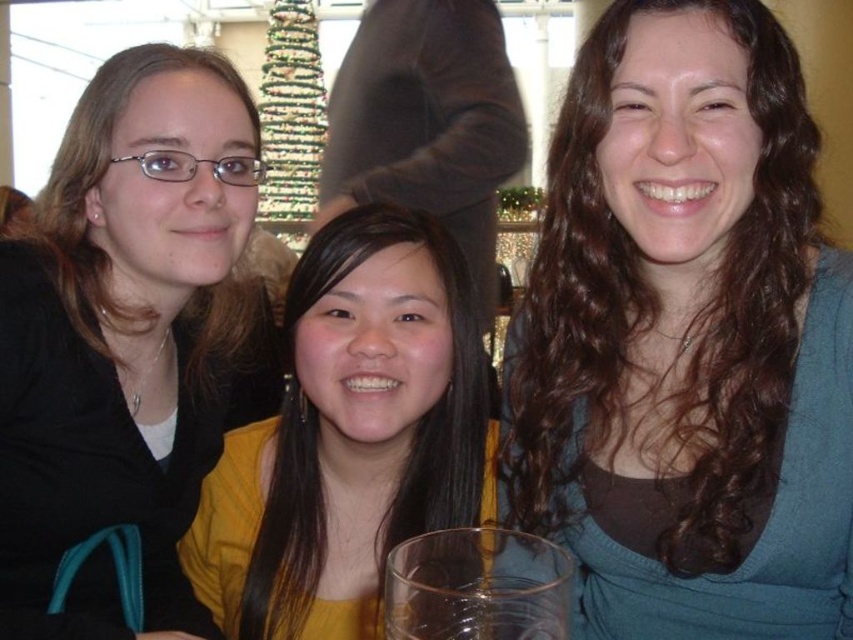
You are a photographer trying to capture a group photo of the matte black hair at left and the yellow matte shirt at center. Since you want to ensure both subjects are in focus, you need to know their relative positions. Which subject is positioned more to the left side?

The matte black hair at left is positioned on the left side of yellow matte shirt at center, so the matte black hair at left is more to the left.

Based on the photo, you are a photographer adjusting the camera settings for a group photo. You need to ensure that the brown curly hair at center and the yellow matte shirt at center are both clearly visible. Given that the camera can focus on objects up to 10 cm in width, which object should you prioritize focusing on to ensure clarity?

The brown curly hair at center has a smaller width than the yellow matte shirt at center, so you should prioritize focusing on the yellow matte shirt at center to ensure clarity since it is wider and may require more focus.

You are a photographer trying to capture a clear shot of the brown curly hair at center and the matte black hair at left. Based on their positions, which one is higher in the frame?

The brown curly hair at center is above matte black hair at left, so it is higher in the frame.